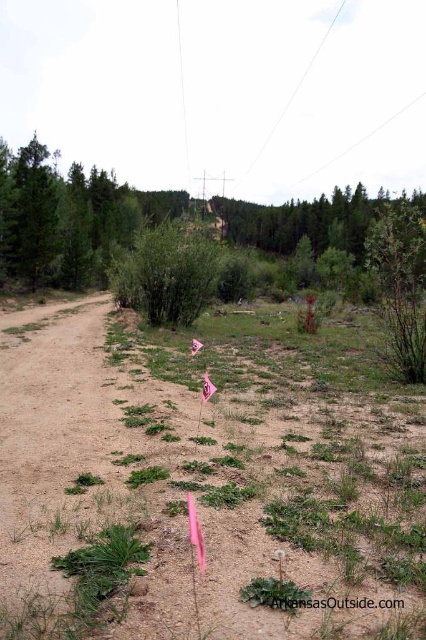
Question: Is dull brown dirt at center behind green leafy bush at center?

Choices:
 (A) no
 (B) yes

Answer: (A)

Question: Among these objects, which one is nearest to the camera?

Choices:
 (A) dull brown dirt at center
 (B) green leafy bush at center

Answer: (A)

Question: Among these points, which one is farthest from the camera?

Choices:
 (A) (210, 602)
 (B) (195, 256)

Answer: (B)

Question: Can you confirm if dull brown dirt at center is positioned below green leafy bush at center?

Choices:
 (A) no
 (B) yes

Answer: (B)

Question: Can you confirm if dull brown dirt at center is positioned above green leafy bush at center?

Choices:
 (A) no
 (B) yes

Answer: (A)